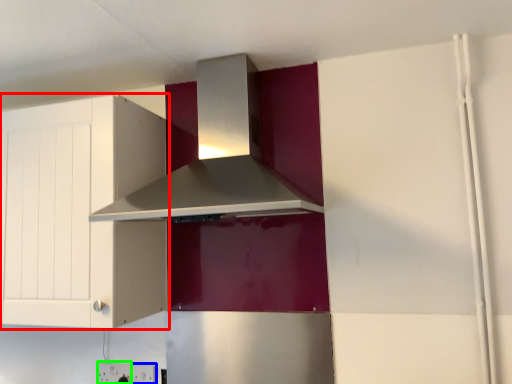
Question: Estimate the real-world distances between objects in this image. Which object is closer to cabinetry (highlighted by a red box), electric outlet (highlighted by a blue box) or electric outlet (highlighted by a green box)?

Choices:
 (A) electric outlet
 (B) electric outlet

Answer: (B)